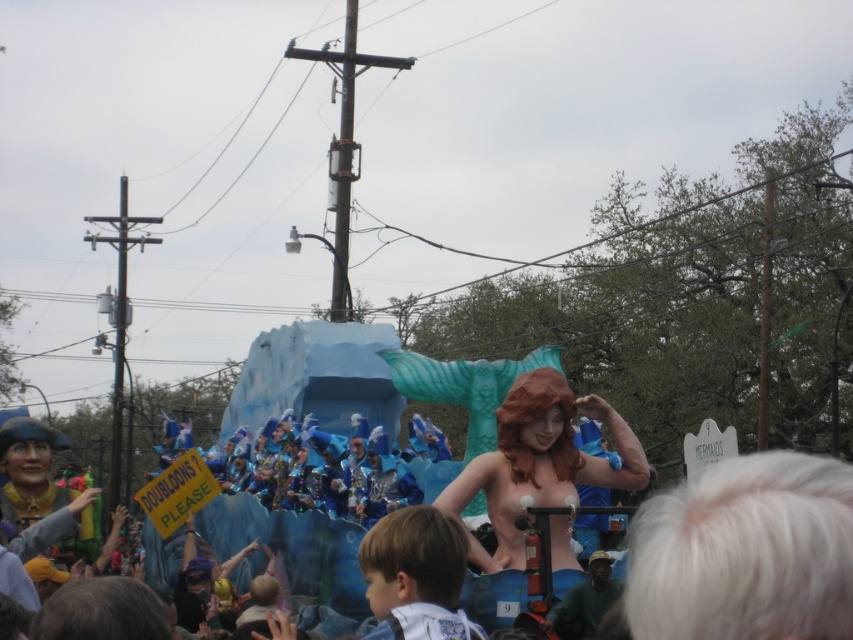
You are a photographer trying to capture the mermaid figure on the float. You notice the smooth blue tail at center and the light brown hair at lower center. Which object should you focus on first if you want to capture the part that is higher up in the image?

The smooth blue tail at center is located above the light brown hair at lower center, so you should focus on the smooth blue tail at center first to capture the higher part.

You are a photographer trying to capture a closeup shot of both the smooth blue tail at center and the light brown hair at lower center from the float. Given that your camera has a maximum zoom range of 10 meters, will you be able to capture both subjects in a single frame without moving the camera?

The distance between the smooth blue tail at center and the light brown hair at lower center is 12.02 meters, which exceeds the camera zoom range of 10 meters. Therefore, you cannot capture both subjects in a single frame without moving the camera.

You are a photographer trying to capture the mermaid figure on the float. You notice two points marked on your camera screen at coordinates point (465,604) and point (367,598). Which point is closer to your camera lens?

Point (465,604) is further to the viewer than point (367,598), so the point closer to the camera lens is point (367,598).